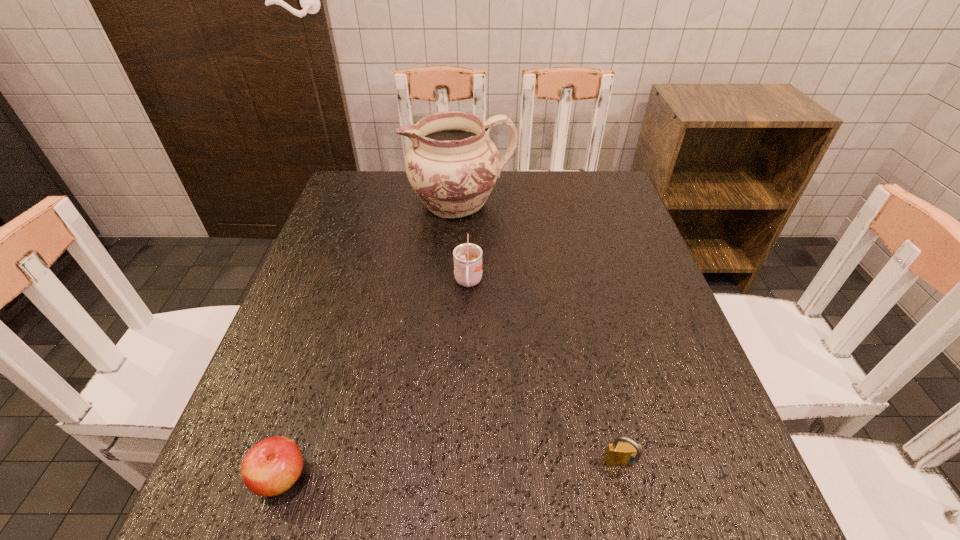
The image size is (960, 540). What are the coordinates of `vacant region at the far left corner` in the screenshot? It's located at (363, 214).

Where is `free space at the near left corner`? The height and width of the screenshot is (540, 960). free space at the near left corner is located at coordinates (243, 538).

The height and width of the screenshot is (540, 960). In the image, there is a desktop. Identify the location of vacant area at the far right corner. (581, 188).

Locate an element on the screen. The height and width of the screenshot is (540, 960). vacant region between the leftmost object and the second farthest object is located at coordinates (374, 380).

You are a GUI agent. You are given a task and a screenshot of the screen. Output one action in this format:
    pyautogui.click(x=<x>, y=<y>)
    Task: Click on the vacant space in between the rightmost object and the third nearest object
    This screenshot has width=960, height=540.
    Given the screenshot: What is the action you would take?
    pyautogui.click(x=544, y=374)

Find the location of a particular element. The image size is (960, 540). free space between the leftmost object and the third nearest object is located at coordinates (374, 380).

The height and width of the screenshot is (540, 960). I want to click on vacant space that's between the leftmost object and the rightmost object, so click(451, 471).

The height and width of the screenshot is (540, 960). Find the location of `free area in between the apple and the cup`. free area in between the apple and the cup is located at coordinates (374, 380).

Find the location of a particular element. The width and height of the screenshot is (960, 540). unoccupied area between the tallest object and the leftmost object is located at coordinates (371, 340).

This screenshot has width=960, height=540. In order to click on vacant region between the padlock and the pitcher in this screenshot , I will do `click(540, 334)`.